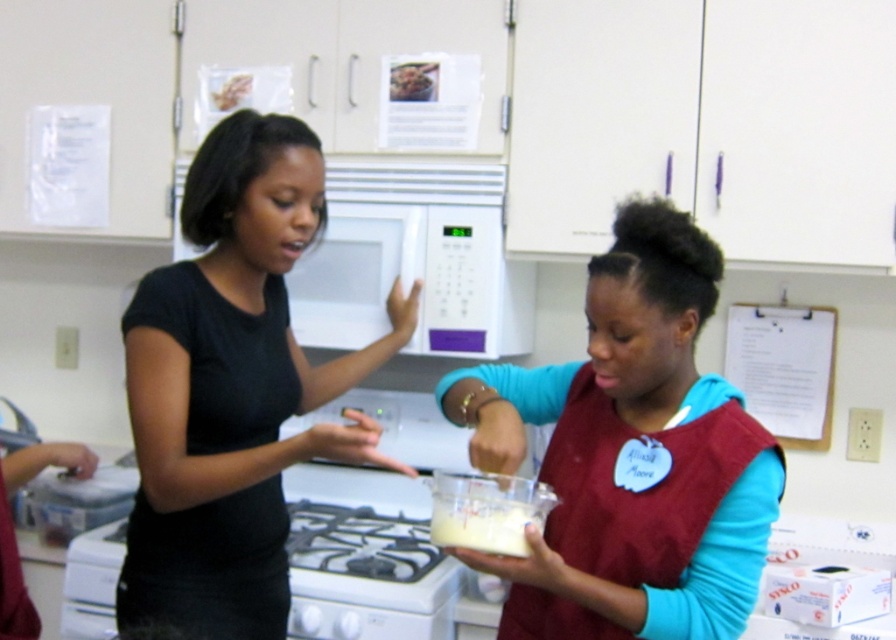
Question: In this image, where is maroon fabric apron at center located relative to white glossy stove at lower center?

Choices:
 (A) above
 (B) below

Answer: (A)

Question: Based on their relative distances, which object is farther from the maroon fabric apron at center?

Choices:
 (A) white opaque liquid at center
 (B) white glossy stove at lower center
 (C) brown crumbly cake at upper center

Answer: (C)

Question: Which object is the farthest from the brown crumbly cake at upper center?

Choices:
 (A) maroon fabric apron at center
 (B) black matte shirt at center
 (C) white opaque liquid at center

Answer: (C)

Question: Among these points, which one is nearest to the camera?

Choices:
 (A) (429, 84)
 (B) (254, 291)
 (C) (337, 584)

Answer: (B)

Question: Does white opaque liquid at center appear on the right side of brown crumbly cake at upper center?

Choices:
 (A) yes
 (B) no

Answer: (A)

Question: Does maroon fabric apron at center appear under white glossy stove at lower center?

Choices:
 (A) yes
 (B) no

Answer: (B)